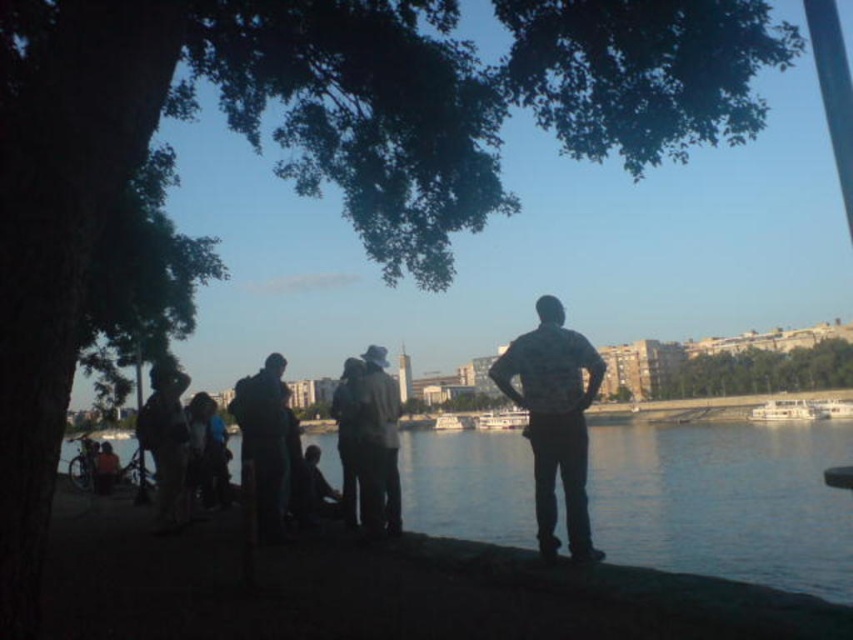
Between point (541, 536) and point (828, 368), which one is positioned behind?

Positioned behind is point (828, 368).

Which of these two, camouflage-patterned shirt at center or green leafy tree at center, stands shorter?

Standing shorter between the two is green leafy tree at center.

Between point (535, 339) and point (712, 376), which one is positioned in front?

Positioned in front is point (535, 339).

I want to click on camouflage-patterned shirt at center, so click(x=554, y=419).

Is green leafy tree at center thinner than dark gray fabric jacket at center?

In fact, green leafy tree at center might be wider than dark gray fabric jacket at center.

Is green leafy tree at center to the left of dark gray fabric jacket at center from the viewer's perspective?

No, green leafy tree at center is not to the left of dark gray fabric jacket at center.

You are a GUI agent. You are given a task and a screenshot of the screen. Output one action in this format:
    pyautogui.click(x=<x>, y=<y>)
    Task: Click on the green leafy tree at center
    The width and height of the screenshot is (853, 640).
    Given the screenshot: What is the action you would take?
    pyautogui.click(x=759, y=371)

From the picture: Who is more forward, (122,440) or (555,387)?

Point (555,387) is more forward.

Is point (590, 458) positioned before point (527, 392)?

No, (590, 458) is further to viewer.

The height and width of the screenshot is (640, 853). Identify the location of blue water at lower center. (726, 500).